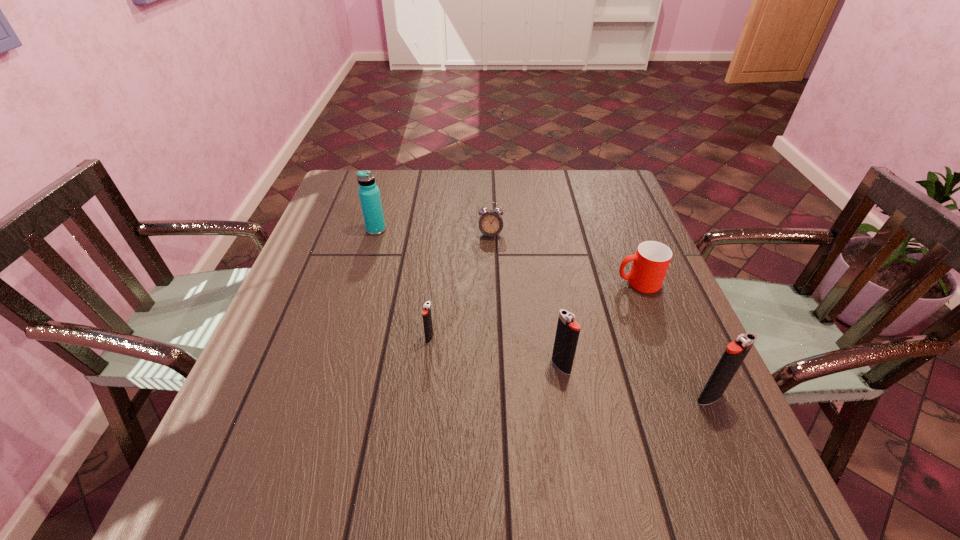
Find the location of a particular element. The height and width of the screenshot is (540, 960). empty space that is in between the rightmost igniter and the alarm clock is located at coordinates coord(600,316).

The width and height of the screenshot is (960, 540). I want to click on free space between the fifth farthest object and the second object from left to right, so click(495, 352).

The width and height of the screenshot is (960, 540). I want to click on unoccupied position between the third farthest object and the shortest igniter, so click(x=534, y=310).

I want to click on vacant space that's between the alarm clock and the nearest object, so click(600, 316).

Locate an element on the screen. The width and height of the screenshot is (960, 540). blank region between the water bottle and the cup is located at coordinates (507, 256).

Where is `vacant space that is in between the alarm clock and the second nearest igniter`? The width and height of the screenshot is (960, 540). vacant space that is in between the alarm clock and the second nearest igniter is located at coordinates (526, 300).

What are the coordinates of `the third closest object to the fourth shortest object` in the screenshot? It's located at (426, 312).

Image resolution: width=960 pixels, height=540 pixels. In order to click on object that ranks as the fourth closest to the nearest object in this screenshot , I will do `click(491, 224)`.

Identify which igniter is located as the nearest to the farthest igniter. Please provide its 2D coordinates. Your answer should be formatted as a tuple, i.e. [(x, y)], where the tuple contains the x and y coordinates of a point satisfying the conditions above.

[(567, 333)]

Locate an element on the screen. The width and height of the screenshot is (960, 540). igniter that is the third nearest to the water bottle is located at coordinates (736, 351).